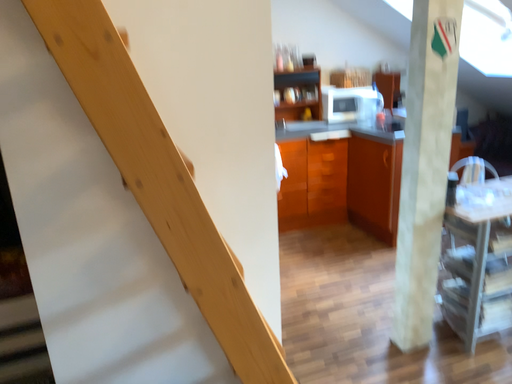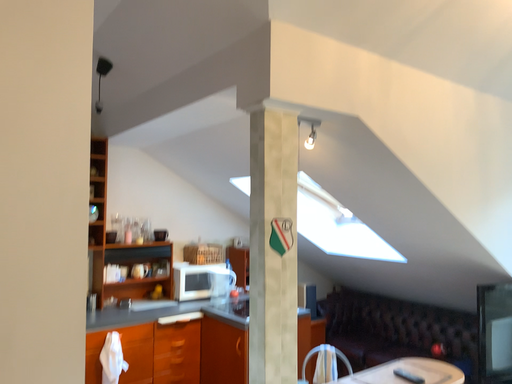
Question: Which way did the camera rotate in the video?

Choices:
 (A) rotated right
 (B) rotated left

Answer: (A)